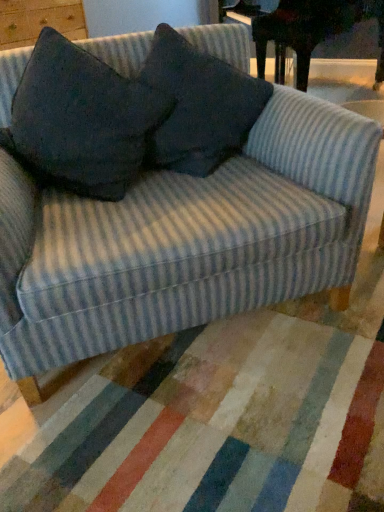
Question: Choose the correct answer: Is dark fabric pillow at center, which is the 1th throw pillow from right to left, inside dark gray fabric pillow at upper center, which is counted as the 1th throw pillow, starting from the left, or outside it?

Choices:
 (A) outside
 (B) inside

Answer: (A)

Question: From the image's perspective, is dark fabric pillow at center, which is the 1th throw pillow from right to left, positioned above or below dark gray fabric pillow at upper center, which is counted as the 1th throw pillow, starting from the left?

Choices:
 (A) below
 (B) above

Answer: (B)

Question: Which of these objects is positioned closest to the dark fabric pillow at center, which is the second throw pillow from left to right?

Choices:
 (A) dark gray fabric pillow at upper center, which is counted as the 1th throw pillow, starting from the left
 (B) dark wood piano at upper right

Answer: (A)

Question: Which is farther from the dark gray fabric pillow at upper center, which appears as the 2th throw pillow when viewed from the right?

Choices:
 (A) dark fabric pillow at center, which is the 1th throw pillow from right to left
 (B) dark wood piano at upper right

Answer: (B)